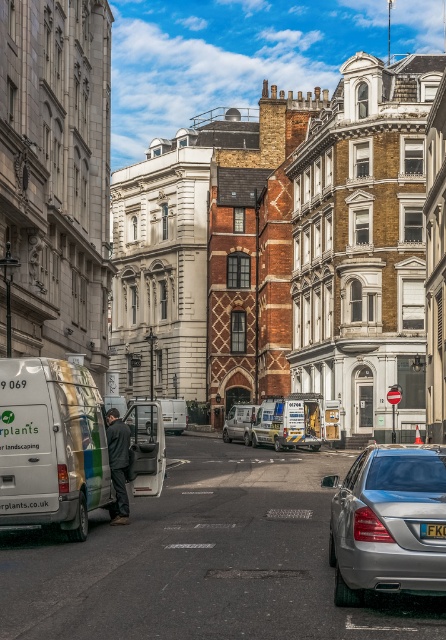
You are a delivery driver who needs to park your metallic silver van at center in a parking spot that is 60 meters wide. Can you fit the van and its black plastic license plate at center into the parking spot without any part of them overhanging?

The metallic silver van at center and black plastic license plate at center are 60.53 meters apart. Since the parking spot is only 60 meters wide, the van and its license plate would overhang by 0.53 meters, so they cannot fit without overhanging.

You are a delivery driver needing to park your vehicle in this street scene. The white metallic van at lower left and the satin silver sedan at lower right are already parked. Which vehicle takes up less space on the street?

The white metallic van at lower left takes up less space on the street because it has a smaller size compared to the satin silver sedan at lower right.